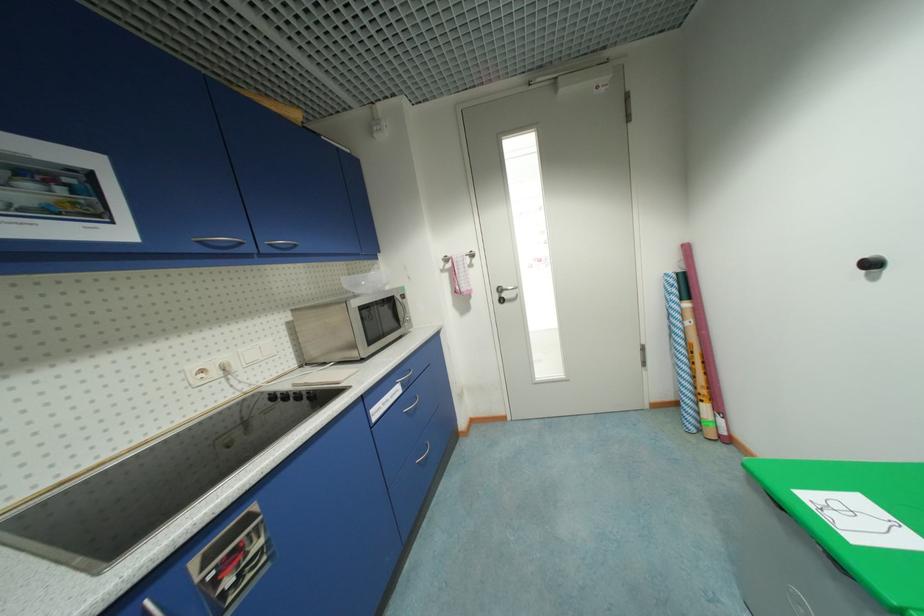
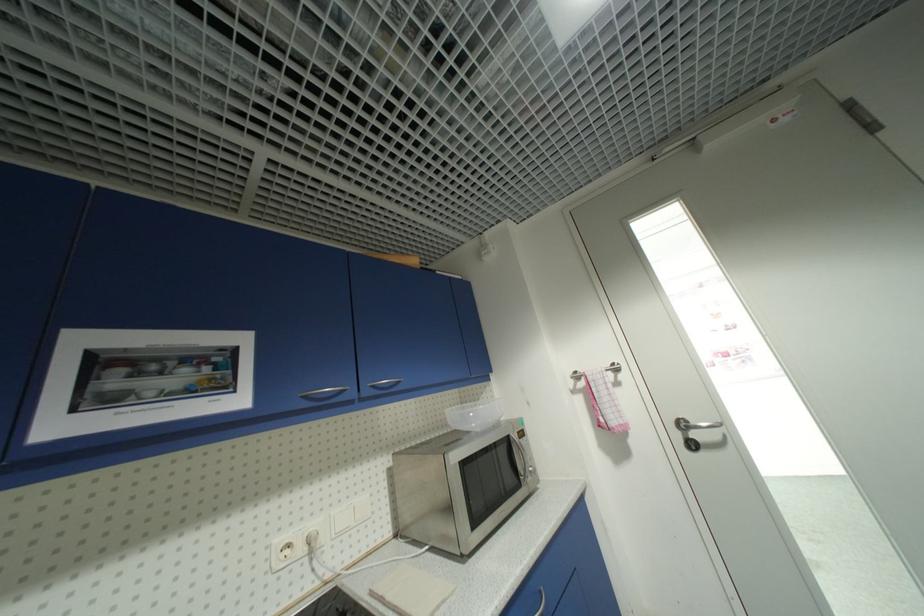
Where in the second image is the point corresponding to pixel 300 387 from the first image?

(378, 594)